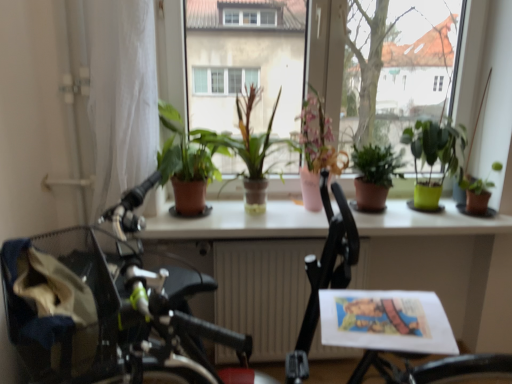
Question: From a real-world perspective, is green matte plant at center, marked as the 3th houseplant in a right-to-left arrangement, below pink ceramic vase at center, which is counted as the third houseplant, starting from the left?

Choices:
 (A) yes
 (B) no

Answer: (A)

Question: Is green matte plant at center, the fourth houseplant viewed from the left, not near pink ceramic vase at center, which is counted as the third houseplant, starting from the left?

Choices:
 (A) no
 (B) yes

Answer: (A)

Question: Can you confirm if green matte plant at center, the fourth houseplant viewed from the left, is positioned to the left of pink ceramic vase at center, which is counted as the third houseplant, starting from the left?

Choices:
 (A) yes
 (B) no

Answer: (B)

Question: Is green matte plant at center, the fourth houseplant viewed from the left, wider than pink ceramic vase at center, which is counted as the 4th houseplant, starting from the right?

Choices:
 (A) no
 (B) yes

Answer: (A)

Question: Does green matte plant at center, marked as the 3th houseplant in a right-to-left arrangement, appear on the right side of pink ceramic vase at center, which is counted as the 4th houseplant, starting from the right?

Choices:
 (A) no
 (B) yes

Answer: (B)

Question: From a real-world perspective, is green matte plant at center, the fourth houseplant viewed from the left, physically located above or below green matte plant at center, the second houseplant positioned from the left?

Choices:
 (A) above
 (B) below

Answer: (B)

Question: Is green matte plant at center, marked as the 3th houseplant in a right-to-left arrangement, taller or shorter than green matte plant at center, which is counted as the 5th houseplant, starting from the right?

Choices:
 (A) tall
 (B) short

Answer: (B)

Question: Is green matte plant at center, marked as the 3th houseplant in a right-to-left arrangement, wider or thinner than green matte plant at center, the second houseplant positioned from the left?

Choices:
 (A) thin
 (B) wide

Answer: (A)

Question: Is green matte plant at center, the fourth houseplant viewed from the left, bigger or smaller than green matte plant at center, which is counted as the 5th houseplant, starting from the right?

Choices:
 (A) small
 (B) big

Answer: (A)

Question: Is green matte plant at center, placed as the 1th houseplant when sorted from left to right, situated inside green matte plant at center, marked as the 3th houseplant in a right-to-left arrangement, or outside?

Choices:
 (A) inside
 (B) outside

Answer: (B)

Question: Based on their sizes in the image, would you say green matte plant at center, the sixth houseplant positioned from the right, is bigger or smaller than green matte plant at center, the fourth houseplant viewed from the left?

Choices:
 (A) big
 (B) small

Answer: (A)

Question: From their relative heights in the image, would you say green matte plant at center, the sixth houseplant positioned from the right, is taller or shorter than green matte plant at center, marked as the 3th houseplant in a right-to-left arrangement?

Choices:
 (A) short
 (B) tall

Answer: (B)

Question: Is green matte plant at center, placed as the 1th houseplant when sorted from left to right, to the left or to the right of green matte plant at center, the fourth houseplant viewed from the left, in the image?

Choices:
 (A) left
 (B) right

Answer: (A)

Question: From the image's perspective, is green plastic pot at right, the 2th houseplant positioned from the right, located above or below white glossy table at center?

Choices:
 (A) above
 (B) below

Answer: (A)

Question: Is green plastic pot at right, the fifth houseplant positioned from the left, wider or thinner than white glossy table at center?

Choices:
 (A) thin
 (B) wide

Answer: (A)